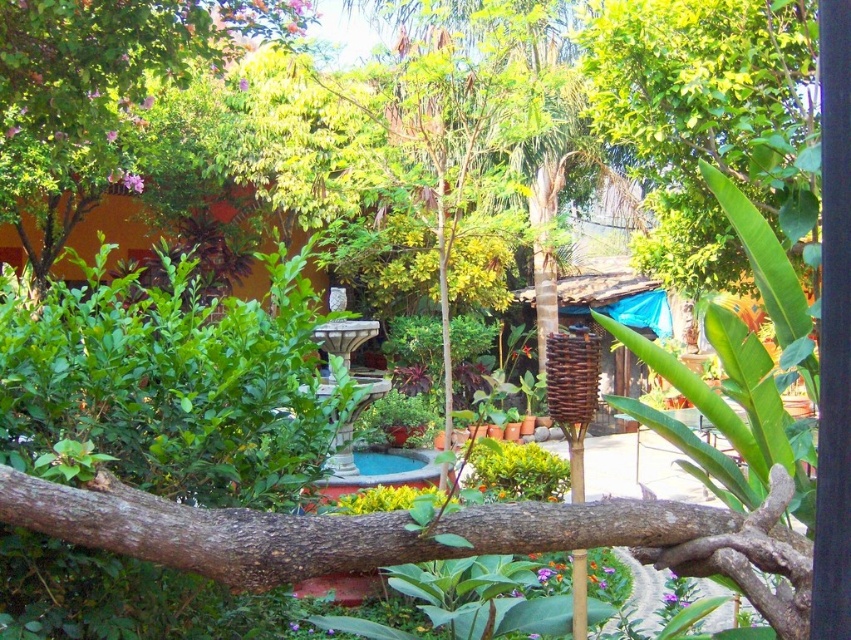
Who is shorter, green leafy bush at left or brown rough tree branch at center?

With less height is brown rough tree branch at center.

Who is lower down, green leafy bush at left or brown rough tree branch at center?

brown rough tree branch at center is lower down.

This screenshot has height=640, width=851. Find the location of `green leafy bush at left`. green leafy bush at left is located at coordinates (169, 385).